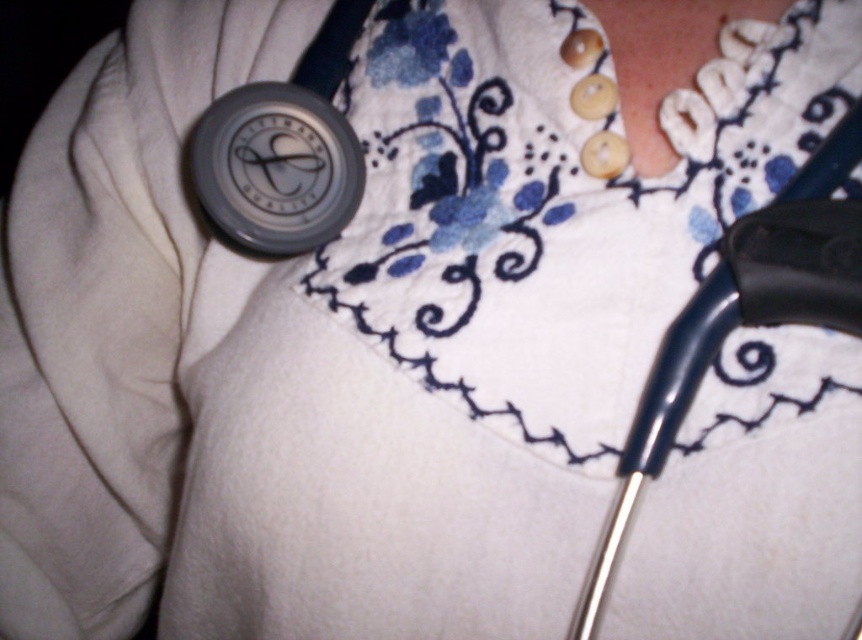
Based on the scene description, where is the matte gray stethoscope at center located in terms of coordinates?

The matte gray stethoscope at center is located at coordinates point (275, 168).

You are a medical student examining the two stethoscopes on a patient. The metallic blue stethoscope at right and the matte gray stethoscope at center are both in view. Which stethoscope is taller?

The metallic blue stethoscope at right has a greater height compared to the matte gray stethoscope at center, so the metallic blue stethoscope at right is taller.